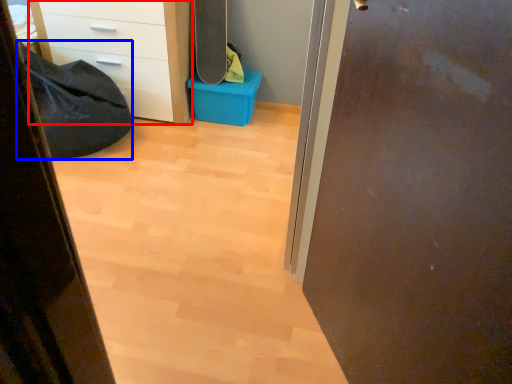
Question: Which object is closer to the camera taking this photo, chest of drawers (highlighted by a red box) or sleeping bag (highlighted by a blue box)?

Choices:
 (A) chest of drawers
 (B) sleeping bag

Answer: (B)